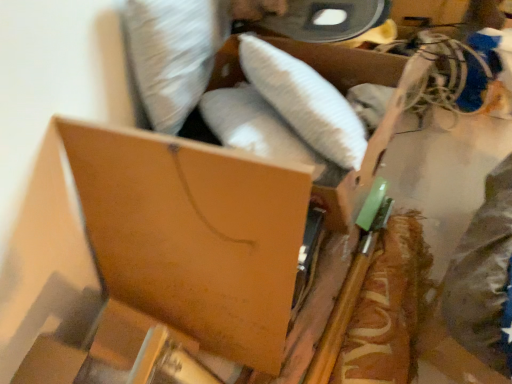
Question: Choose the correct answer: Is brown cardboard box at center, which is the 2th storage box from top to bottom, inside brown cardboard box at upper center, which ranks as the first storage box in top-to-bottom order, or outside it?

Choices:
 (A) inside
 (B) outside

Answer: (B)

Question: Is brown cardboard box at center, which is the 2th storage box from top to bottom, in front of or behind brown cardboard box at upper center, which ranks as the first storage box in top-to-bottom order, in the image?

Choices:
 (A) front
 (B) behind

Answer: (A)

Question: Which object is the closest to the brown cardboard box at center, which is the 2th storage box from top to bottom?

Choices:
 (A) wooden spatula at right
 (B) brown cardboard box at upper center, acting as the 2th storage box starting from the bottom

Answer: (B)

Question: Which of these objects is positioned farthest from the wooden spatula at right?

Choices:
 (A) brown cardboard box at upper center, which ranks as the first storage box in top-to-bottom order
 (B) brown cardboard box at center, the 1th storage box in the bottom-to-top sequence

Answer: (B)